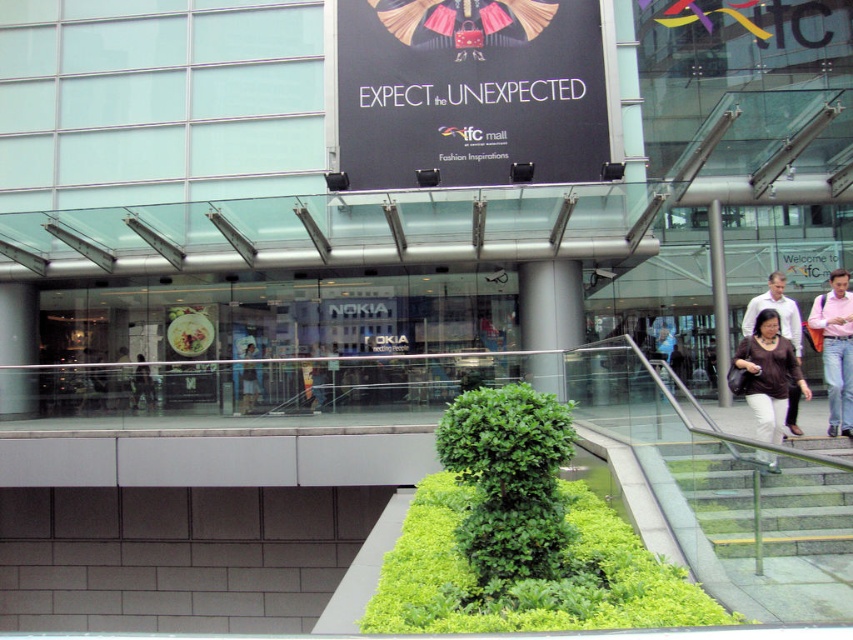
You are a delivery person standing at the base of the stairs with a package for the security office located near the black matte sign at upper center. The security office is 10 meters away from your current position. Can you reach the security office before the camera, which is also nearby?

The black matte sign at upper center and camera are 15.36 meters apart. Since the security office is only 10 meters away from your current position, you can reach the security office before the camera.

You are standing at the entrance of the mall and want to reach the information desk located at point (419, 92). If your walking speed is 1.5 meters per second, how many seconds will it take you to reach the information desk?

The distance between you and the point (419, 92) is 16.02 meters. At a walking speed of 1.5 meters per second, it will take approximately 10.68 seconds to reach the information desk. Since we usually round to the nearest whole number, it would take about 11 seconds.